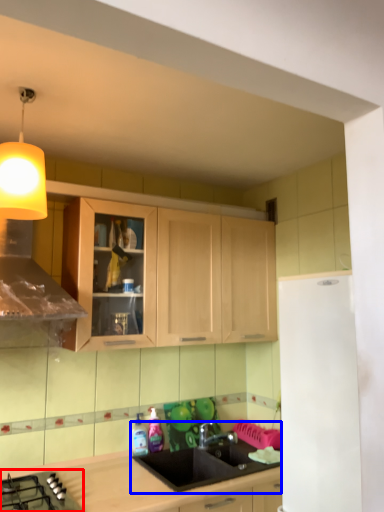
Question: Which object appears farthest to the camera in this image, gas stove (highlighted by a red box) or sink (highlighted by a blue box)?

Choices:
 (A) gas stove
 (B) sink

Answer: (B)